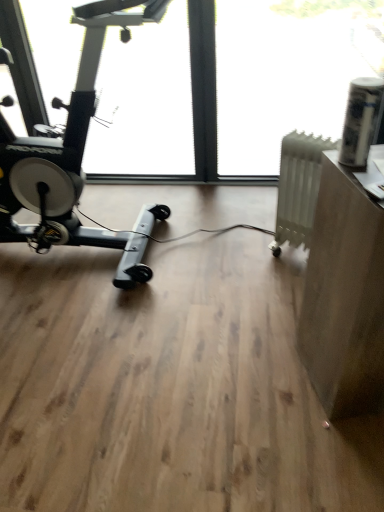
Question: Is matte brown desk at right outside transparent glass window at center, which is the first window screen from left to right?

Choices:
 (A) yes
 (B) no

Answer: (A)

Question: Is transparent glass window at center, which is the first window screen from left to right, completely or partially inside matte brown desk at right?

Choices:
 (A) no
 (B) yes

Answer: (A)

Question: Does matte brown desk at right have a lesser width compared to transparent glass window at center, which is the first window screen from left to right?

Choices:
 (A) no
 (B) yes

Answer: (B)

Question: From the image's perspective, is matte brown desk at right on top of transparent glass window at center, which is the first window screen from left to right?

Choices:
 (A) no
 (B) yes

Answer: (A)

Question: Is matte brown desk at right oriented away from transparent glass window at center, which is the first window screen from left to right?

Choices:
 (A) yes
 (B) no

Answer: (B)

Question: Does matte brown desk at right come behind transparent glass window at center, the 2th window screen when ordered from right to left?

Choices:
 (A) no
 (B) yes

Answer: (A)

Question: Considering the relative positions of transparent glass window at center, the 2th window screen when ordered from right to left, and white matte radiator at right in the image provided, is transparent glass window at center, the 2th window screen when ordered from right to left, in front of white matte radiator at right?

Choices:
 (A) no
 (B) yes

Answer: (B)

Question: Can you confirm if transparent glass window at center, the 2th window screen when ordered from right to left, is taller than white matte radiator at right?

Choices:
 (A) no
 (B) yes

Answer: (B)

Question: Does transparent glass window at center, the 2th window screen when ordered from right to left, have a lesser width compared to white matte radiator at right?

Choices:
 (A) no
 (B) yes

Answer: (A)

Question: Is transparent glass window at center, the 2th window screen when ordered from right to left, behind white matte radiator at right?

Choices:
 (A) no
 (B) yes

Answer: (A)

Question: Can you confirm if transparent glass window at center, which is the first window screen from left to right, is wider than white matte radiator at right?

Choices:
 (A) no
 (B) yes

Answer: (B)

Question: Does transparent glass window at center, the 2th window screen when ordered from right to left, have a lesser height compared to white matte radiator at right?

Choices:
 (A) no
 (B) yes

Answer: (A)

Question: Is transparent glass window at center, which is the first window screen from left to right, at the back of transparent plastic window screen at upper right, which appears as the 1th window screen when viewed from the right?

Choices:
 (A) yes
 (B) no

Answer: (B)